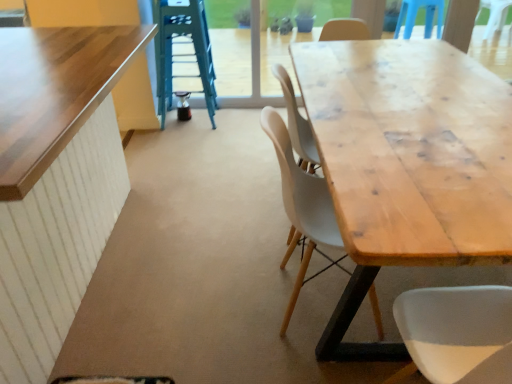
Question: Looking at the image, does natural wood table at center, the 2th table when ordered from left to right, seem bigger or smaller compared to green metallic ladder at upper center?

Choices:
 (A) big
 (B) small

Answer: (A)

Question: Is point (416, 246) closer or farther from the camera than point (161, 76)?

Choices:
 (A) farther
 (B) closer

Answer: (B)

Question: Which is farther from the natural wood table at center, the 2th table when ordered from left to right?

Choices:
 (A) green metallic ladder at upper center
 (B) matte wood chair at center
 (C) wooden table at left, marked as the second table in a right-to-left arrangement

Answer: (A)

Question: Which of these objects is positioned closest to the matte wood chair at center?

Choices:
 (A) natural wood table at center, positioned as the first table in right-to-left order
 (B) green metallic ladder at upper center
 (C) wooden table at left, the 1th table viewed from the left

Answer: (A)